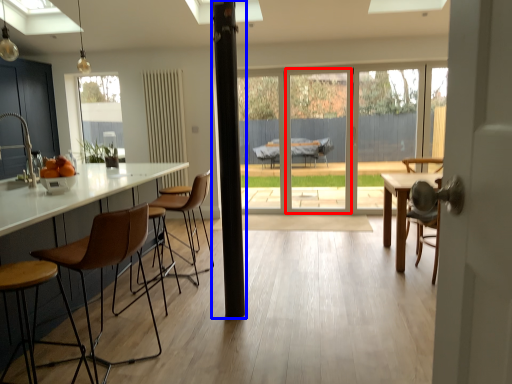
Question: Which point is closer to the camera, screen door (highlighted by a red box) or pillar (highlighted by a blue box)?

Choices:
 (A) screen door
 (B) pillar

Answer: (B)